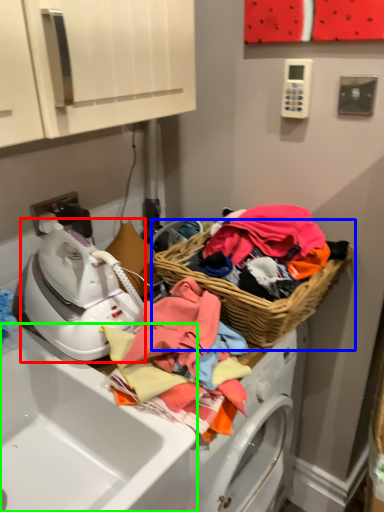
Question: Based on their relative distances, which object is farther from washer (highlighted by a red box)? Choose from picnic basket (highlighted by a blue box) and sink (highlighted by a green box).

Choices:
 (A) picnic basket
 (B) sink

Answer: (A)